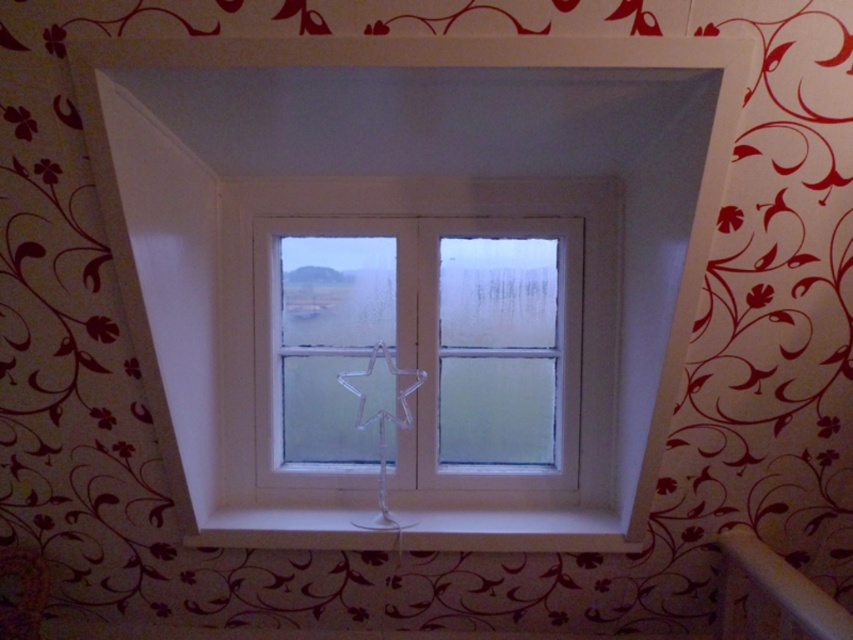
Which is in front, point (450, 42) or point (346, 412)?

Point (450, 42) is more forward.

Can you confirm if white plastic window frame at center is smaller than frosted glass window at center?

Incorrect, white plastic window frame at center is not smaller in size than frosted glass window at center.

This screenshot has height=640, width=853. Identify the location of white plastic window frame at center. (407, 253).

Which is more to the left, frosted glass window at center or white glossy shelf at lower center?

white glossy shelf at lower center

Can you confirm if frosted glass window at center is bigger than white glossy shelf at lower center?

Correct, frosted glass window at center is larger in size than white glossy shelf at lower center.

Does point (463, 241) lie in front of point (561, 513)?

No, (463, 241) is further to viewer.

In order to click on frosted glass window at center in this screenshot , I will do `click(426, 353)`.

Describe the element at coordinates (407, 253) in the screenshot. I see `white plastic window frame at center` at that location.

Does white plastic window frame at center have a smaller size compared to white glossy shelf at lower center?

No.

Between point (239, 330) and point (296, 534), which one is positioned in front?

Point (296, 534) is in front.

This screenshot has width=853, height=640. Identify the location of white plastic window frame at center. (407, 253).